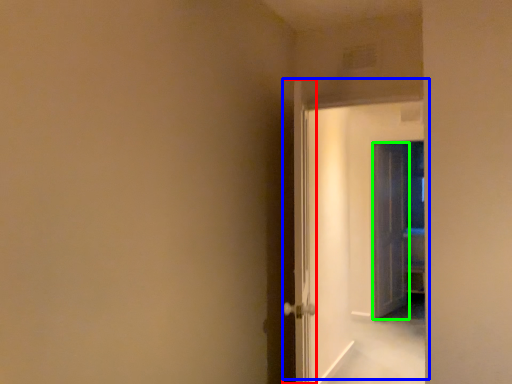
Question: Based on their relative distances, which object is farther from door (highlighted by a red box)? Choose from door (highlighted by a blue box) and door (highlighted by a green box).

Choices:
 (A) door
 (B) door

Answer: (B)